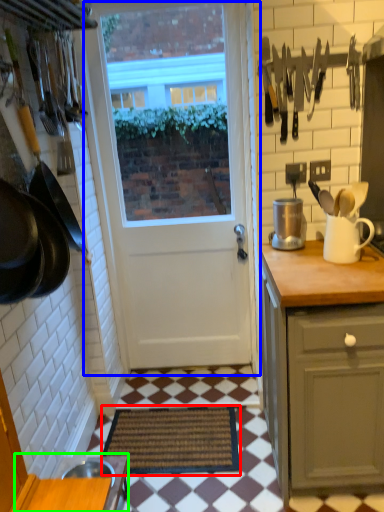
Question: Considering the real-world distances, which object is closest to doormat (highlighted by a red box)? door (highlighted by a blue box) or table (highlighted by a green box).

Choices:
 (A) door
 (B) table

Answer: (B)